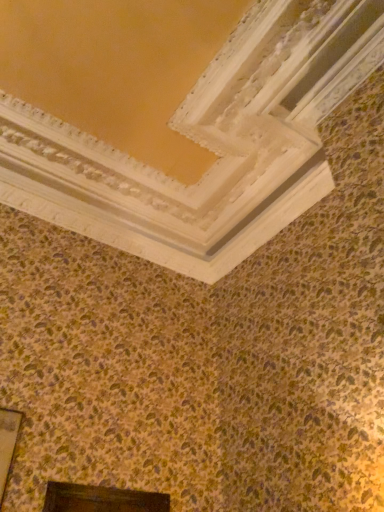
In order to face white textured molding at upper center, should I rotate leftwards or rightwards?

To align with it, rotate left about 4.823°.

The height and width of the screenshot is (512, 384). Identify the location of white textured molding at upper center. [x=190, y=142].

Image resolution: width=384 pixels, height=512 pixels. Describe the element at coordinates (190, 142) in the screenshot. I see `white textured molding at upper center` at that location.

Find the location of `white textured molding at upper center`. white textured molding at upper center is located at coordinates (190, 142).